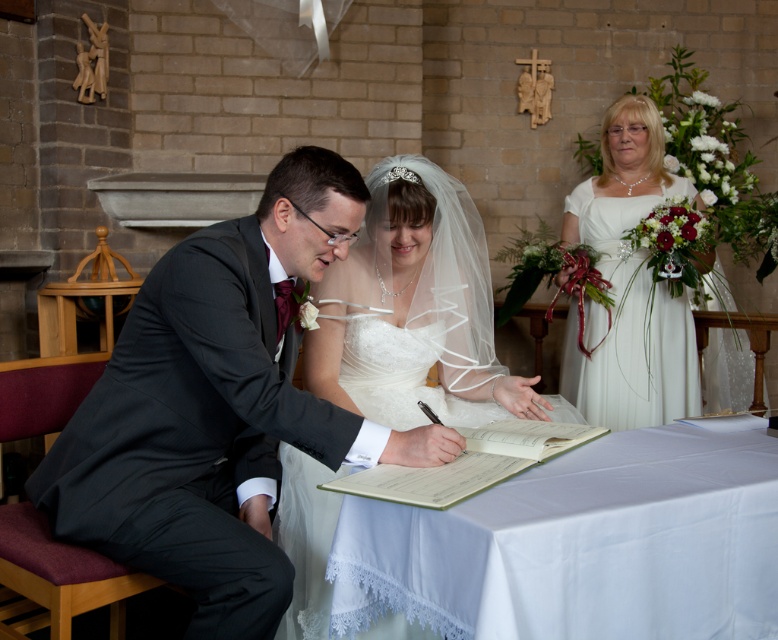
Question: Considering the real-world distances, which object is farthest from the dark gray suit at center?

Choices:
 (A) white satin dress at center
 (B) white lace tablecloth at center
 (C) white satin dress at right

Answer: (C)

Question: Does white lace tablecloth at center have a smaller size compared to white satin dress at right?

Choices:
 (A) no
 (B) yes

Answer: (B)

Question: Is white lace tablecloth at center bigger than white satin dress at center?

Choices:
 (A) yes
 (B) no

Answer: (B)

Question: Among these objects, which one is nearest to the camera?

Choices:
 (A) white lace tablecloth at center
 (B) white satin dress at center
 (C) white satin dress at right
 (D) dark gray suit at center

Answer: (A)

Question: Which object is the farthest from the white lace tablecloth at center?

Choices:
 (A) dark gray suit at center
 (B) white satin dress at center
 (C) white satin dress at right

Answer: (C)

Question: Where is dark gray suit at center located in relation to white satin dress at right in the image?

Choices:
 (A) right
 (B) left

Answer: (B)